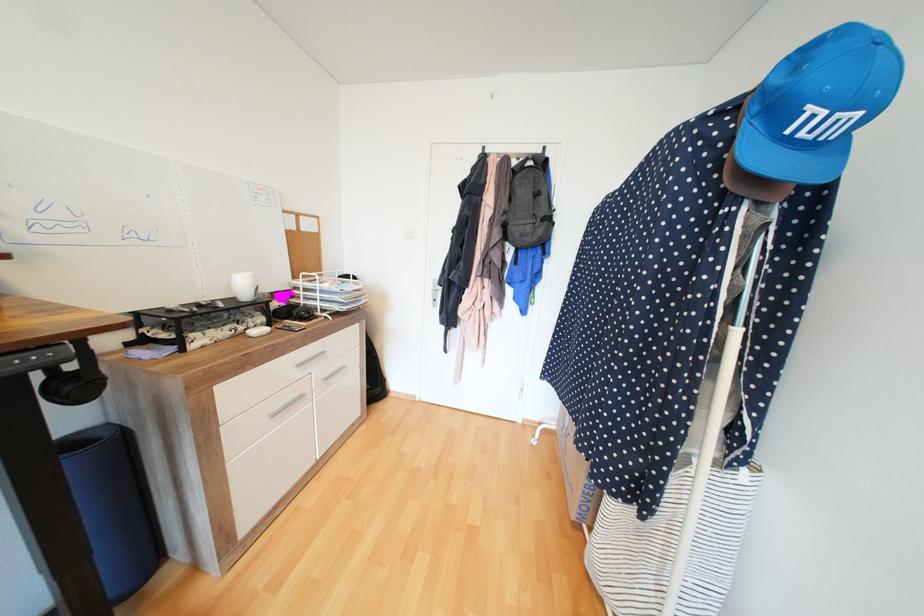
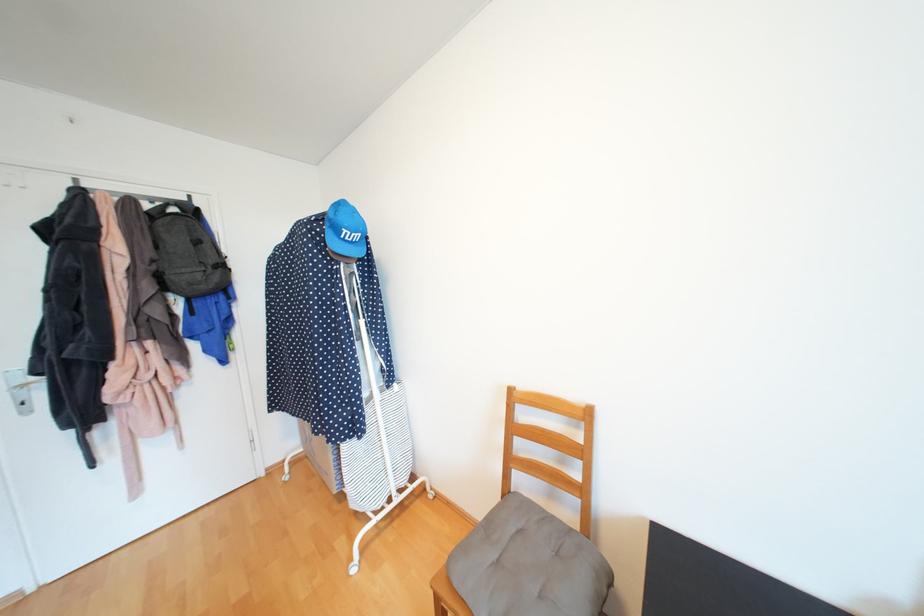
Locate, in the second image, the point that corresponds to point (511, 213) in the first image.

(160, 262)